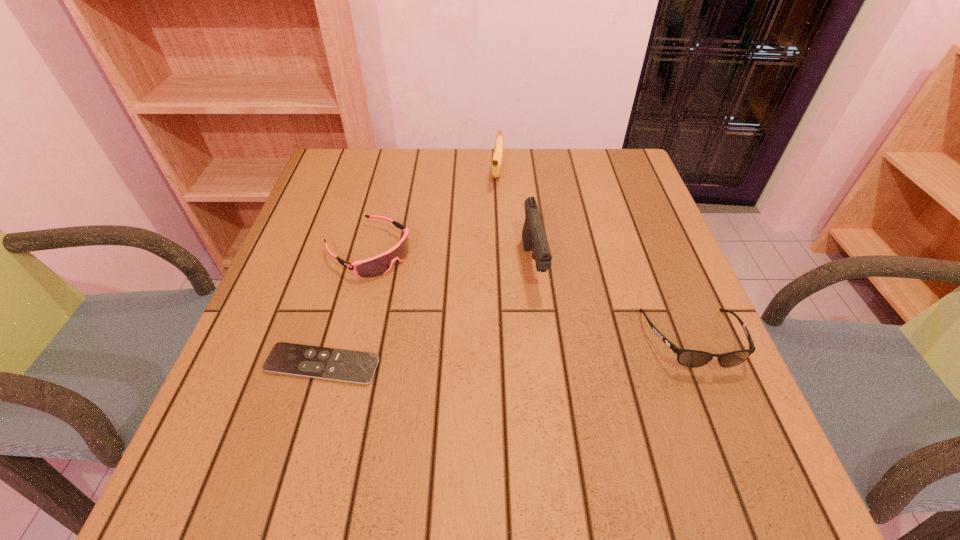
The width and height of the screenshot is (960, 540). What are the coordinates of `vacant area situated 0.260m on the front-facing side of the goggles` in the screenshot? It's located at (487, 331).

This screenshot has height=540, width=960. I want to click on free space located at the barrel of the pistol, so click(x=545, y=333).

Locate an element on the screen. The width and height of the screenshot is (960, 540). free location located 0.170m at the barrel of the pistol is located at coordinates (554, 368).

Where is `free space located at the barrel of the pistol`? free space located at the barrel of the pistol is located at coordinates (553, 364).

Image resolution: width=960 pixels, height=540 pixels. Identify the location of vacant space situated at the stem of the third object from right to left. (486, 277).

This screenshot has height=540, width=960. In order to click on free region located at the stem of the third object from right to left in this screenshot , I will do `click(487, 271)`.

In order to click on vacant space located 0.140m at the stem of the third object from right to left in this screenshot , I will do `click(492, 225)`.

Locate an element on the screen. object situated at the far edge is located at coordinates tap(496, 166).

Where is `object located in the near edge section of the desktop`? The width and height of the screenshot is (960, 540). object located in the near edge section of the desktop is located at coordinates [356, 367].

Find the location of a particular element. The height and width of the screenshot is (540, 960). remote control located in the left edge section of the desktop is located at coordinates (356, 367).